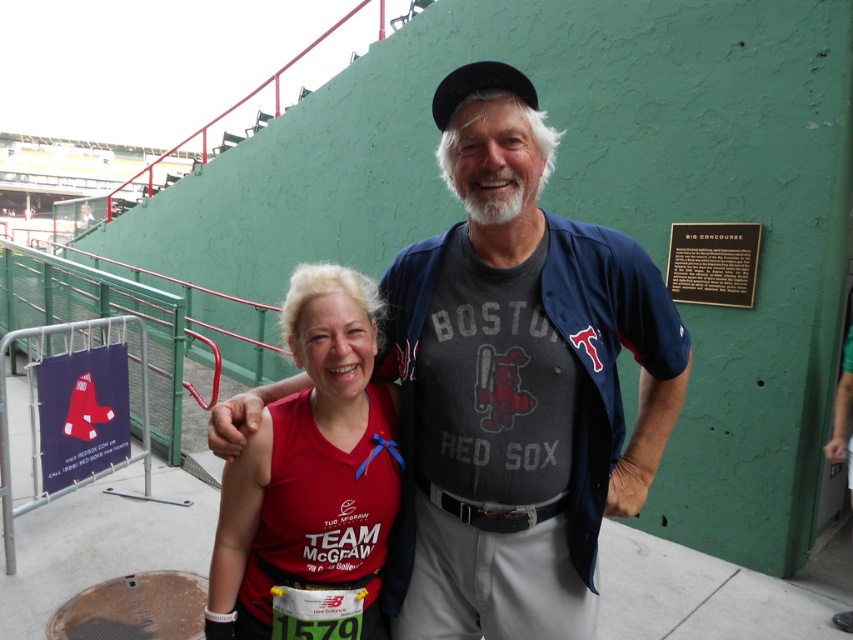
Does dark blue jersey at center appear on the left side of matte red shirt at center?

Incorrect, dark blue jersey at center is not on the left side of matte red shirt at center.

The width and height of the screenshot is (853, 640). Describe the element at coordinates (515, 385) in the screenshot. I see `dark blue jersey at center` at that location.

The width and height of the screenshot is (853, 640). I want to click on dark blue jersey at center, so click(515, 385).